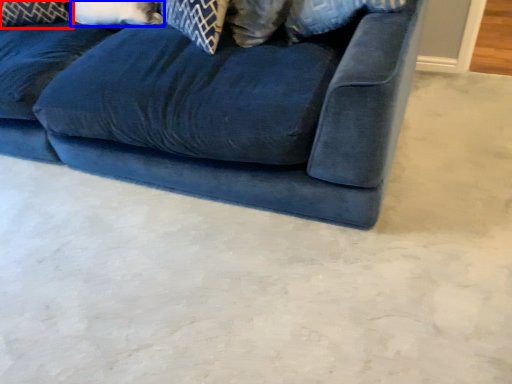
Question: Among these objects, which one is farthest to the camera, pillow (highlighted by a red box) or pillow (highlighted by a blue box)?

Choices:
 (A) pillow
 (B) pillow

Answer: (A)